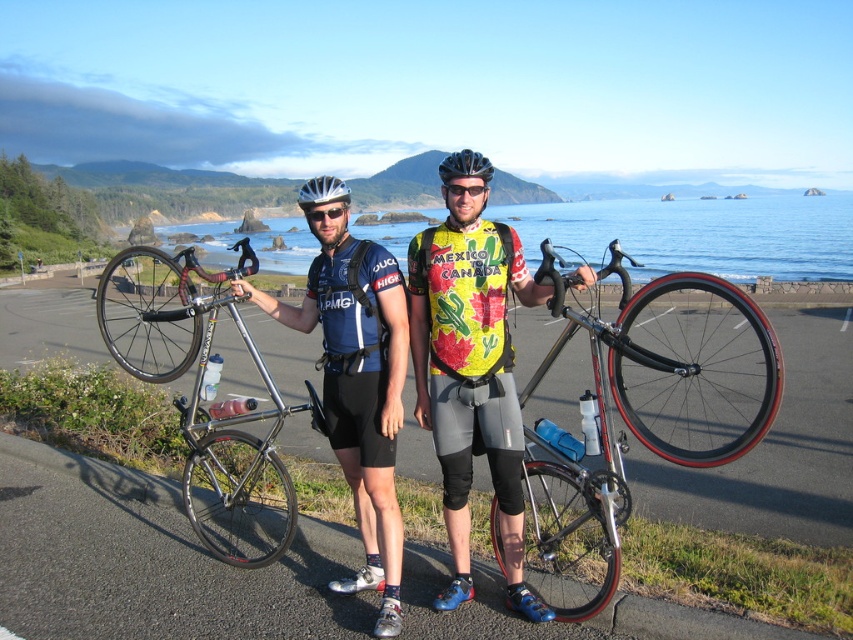
Where is `shiny silver bicycle at center`? Image resolution: width=853 pixels, height=640 pixels. shiny silver bicycle at center is located at coordinates (639, 413).

Where is `shiny silver bicycle at center`? shiny silver bicycle at center is located at coordinates (639, 413).

Measure the distance between point (583, 451) and camera.

3.60 meters

Can you confirm if shiny silver bicycle at center is shorter than transparent plastic goggles at center?

In fact, shiny silver bicycle at center may be taller than transparent plastic goggles at center.

This screenshot has height=640, width=853. Find the location of `shiny silver bicycle at center`. shiny silver bicycle at center is located at coordinates (639, 413).

Who is lower down, silver metallic bicycle at left or silver metallic helmet at center?

silver metallic bicycle at left is lower down.

Who is positioned more to the left, silver metallic bicycle at left or silver metallic helmet at center?

From the viewer's perspective, silver metallic bicycle at left appears more on the left side.

Image resolution: width=853 pixels, height=640 pixels. In order to click on silver metallic bicycle at left in this screenshot , I will do `click(200, 397)`.